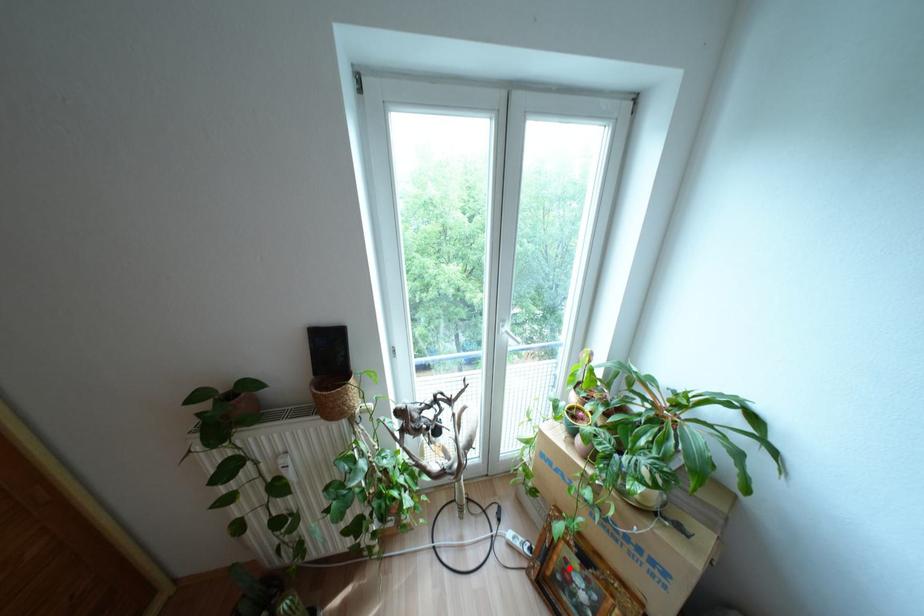
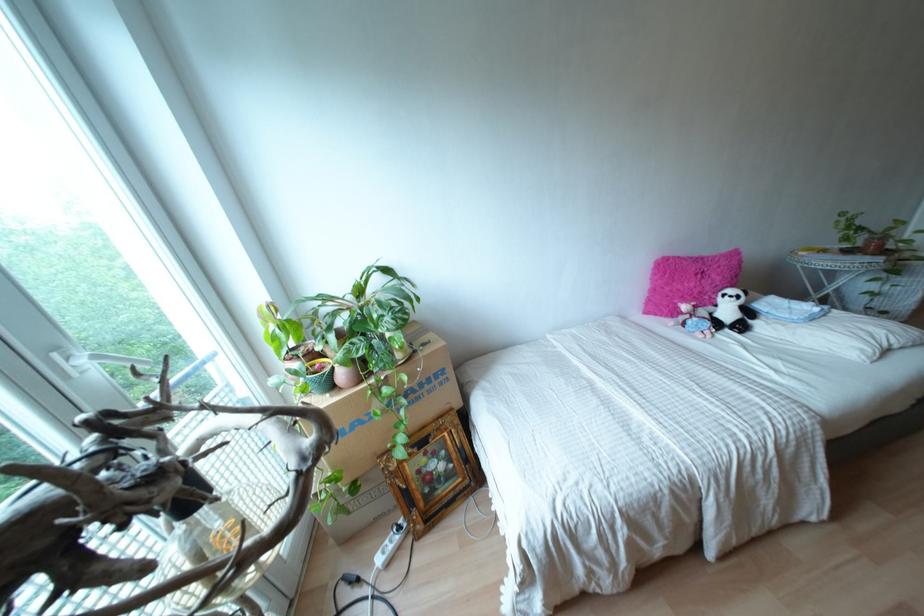
In the second image, find the point that corresponds to the highlighted location in the first image.

(423, 469)